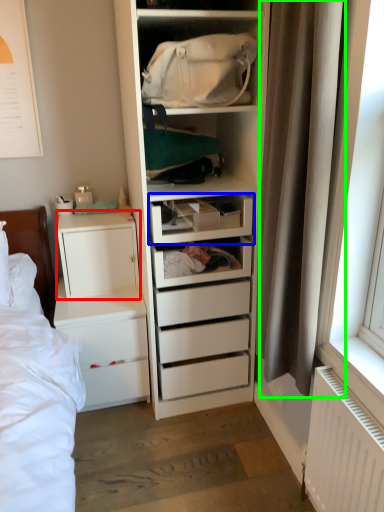
Question: Which is farther away from cabinetry (highlighted by a red box)? drawer (highlighted by a blue box) or curtain (highlighted by a green box)?

Choices:
 (A) drawer
 (B) curtain

Answer: (B)